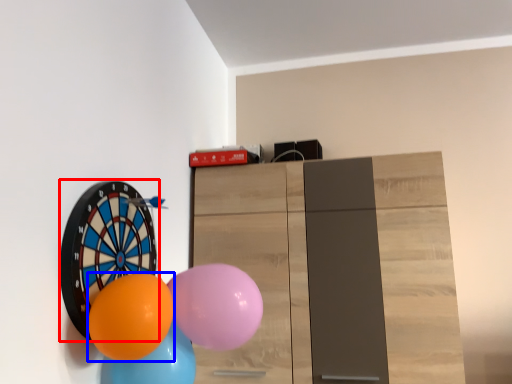
Question: Among these objects, which one is farthest to the camera, balloon (highlighted by a red box) or balloon (highlighted by a blue box)?

Choices:
 (A) balloon
 (B) balloon

Answer: (A)